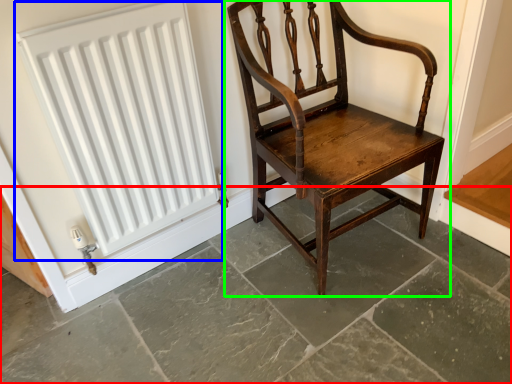
Question: Which is nearer to the concrete (highlighted by a red box)? radiator (highlighted by a blue box) or chair (highlighted by a green box).

Choices:
 (A) radiator
 (B) chair

Answer: (B)